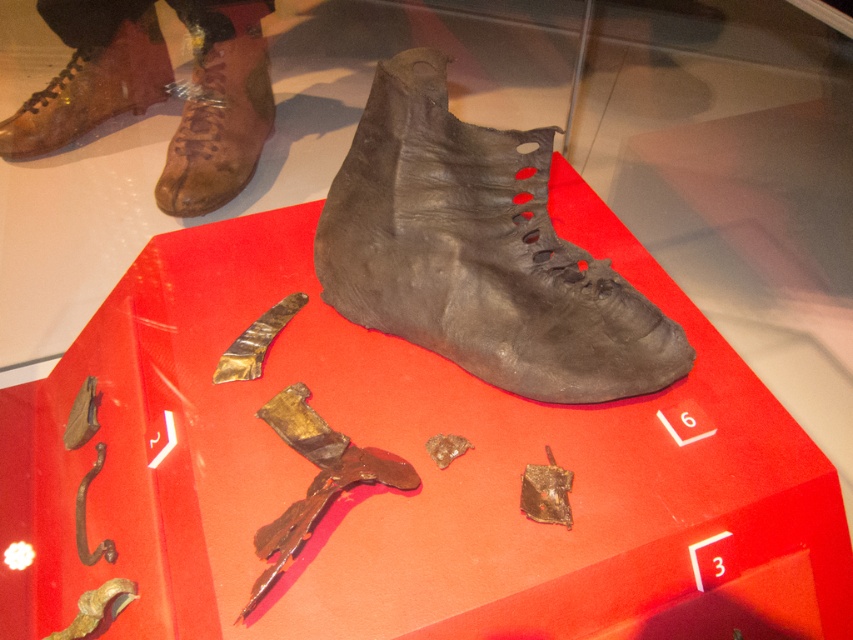
Does point (546, 172) come in front of point (86, 125)?

That is True.

Is matte black boot at center thinner than matte leather boot at upper left?

Incorrect, matte black boot at center's width is not less than matte leather boot at upper left's.

Where is `matte black boot at center`? Image resolution: width=853 pixels, height=640 pixels. matte black boot at center is located at coordinates (479, 252).

This screenshot has height=640, width=853. What are the coordinates of `matte black boot at center` in the screenshot? It's located at (479, 252).

Is matte black boot at center bigger than leather boot at upper left?

Yes.

Which of these two, matte black boot at center or leather boot at upper left, stands shorter?

leather boot at upper left is shorter.

Does point (409, 52) come in front of point (212, 52)?

Yes, point (409, 52) is in front of point (212, 52).

At what (x,y) coordinates should I click in order to perform the action: click on matte black boot at center. Please return your answer as a coordinate pair (x, y). Image resolution: width=853 pixels, height=640 pixels. Looking at the image, I should click on (479, 252).

Between point (202, 189) and point (111, 113), which one is positioned behind?

The point (111, 113) is more distant.

Who is more forward, (x=207, y=163) or (x=155, y=72)?

Positioned in front is point (x=207, y=163).

Which is behind, point (173, 176) or point (132, 36)?

Positioned behind is point (132, 36).

Locate an element on the screen. The width and height of the screenshot is (853, 640). leather boot at upper left is located at coordinates (218, 124).